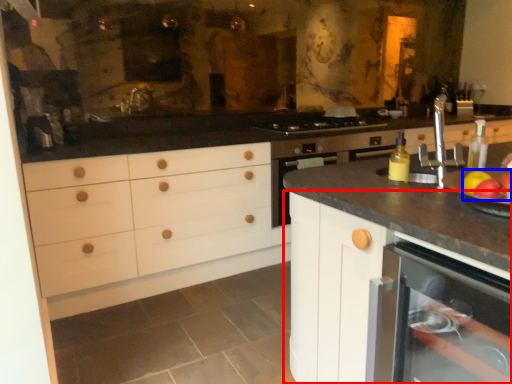
Question: Which of the following is the closest to the observer, cabinetry (highlighted by a red box) or apple (highlighted by a blue box)?

Choices:
 (A) cabinetry
 (B) apple

Answer: (A)